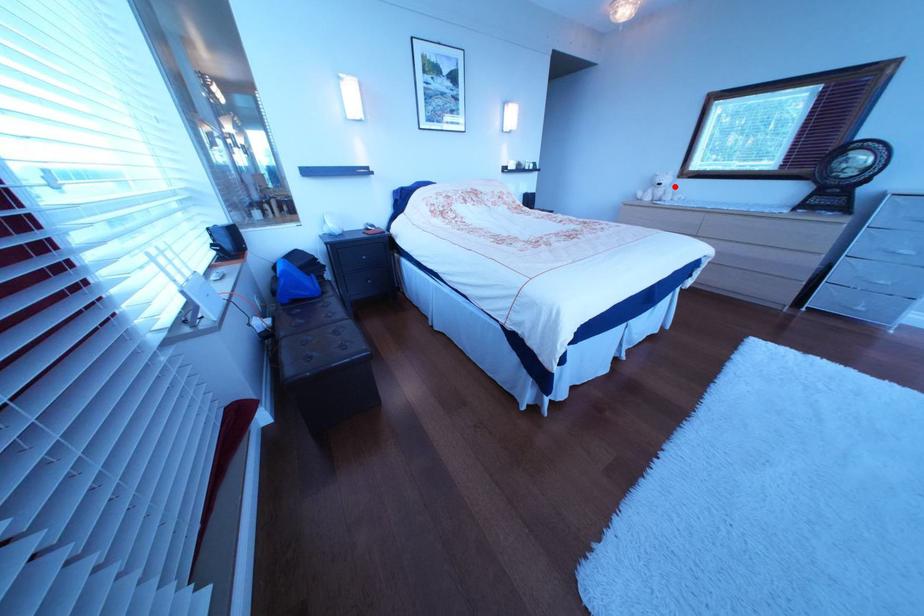
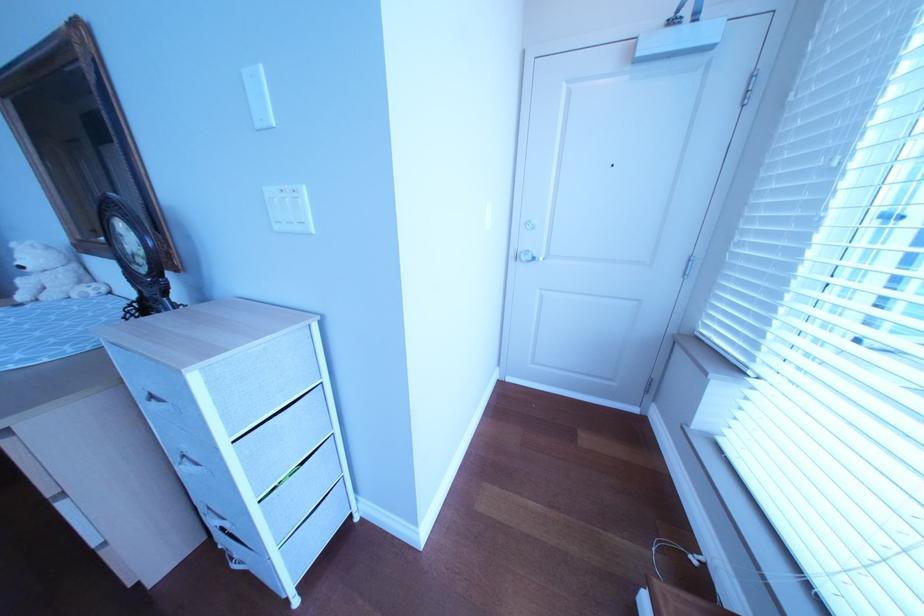
Question: I am providing you with two images of the same scene from different viewpoints. A red point is shown in image1. For the corresponding object point in image2, is it positioned nearer or farther from the camera?

Choices:
 (A) Nearer
 (B) Farther

Answer: (A)